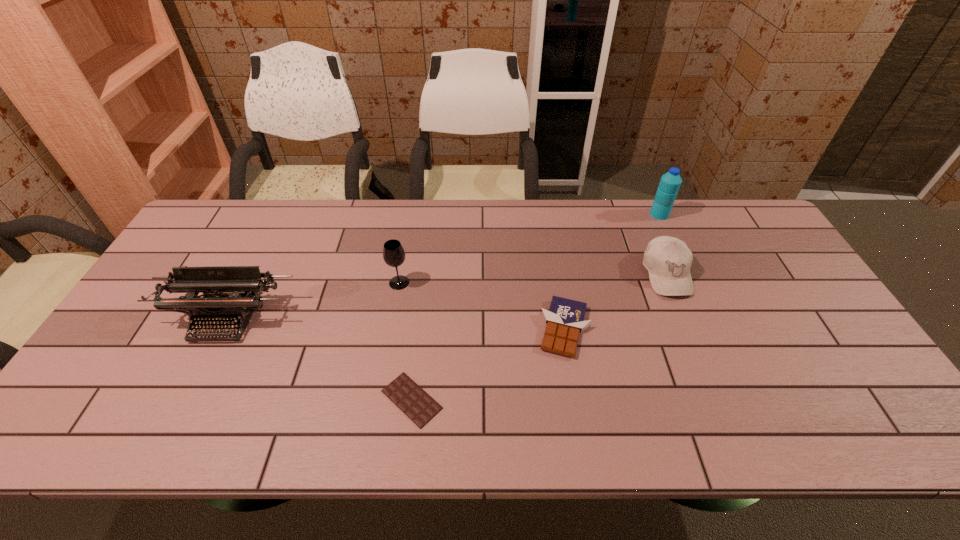
This screenshot has height=540, width=960. In order to click on unoccupied area between the nearest object and the fourth tallest object in this screenshot , I will do `click(540, 337)`.

Locate an element on the screen. This screenshot has height=540, width=960. vacant space that's between the baseball cap and the leftmost object is located at coordinates (446, 296).

Find the location of a particular element. free spot between the right chocolate bar and the wineglass is located at coordinates (x=482, y=306).

The height and width of the screenshot is (540, 960). Find the location of `the closest object to the left chocolate bar`. the closest object to the left chocolate bar is located at coordinates 565,320.

Identify which object is located as the third nearest to the nearer chocolate bar. Please provide its 2D coordinates. Your answer should be formatted as a tuple, i.e. [(x, y)], where the tuple contains the x and y coordinates of a point satisfying the conditions above.

[(243, 283)]

Where is `vacant point that satisfies the following two spatial constraints: 1. on the typing side of the leftmost object; 2. on the right side of the right chocolate bar`? Image resolution: width=960 pixels, height=540 pixels. vacant point that satisfies the following two spatial constraints: 1. on the typing side of the leftmost object; 2. on the right side of the right chocolate bar is located at coordinates (221, 328).

You are a GUI agent. You are given a task and a screenshot of the screen. Output one action in this format:
    pyautogui.click(x=<x>, y=<y>)
    Task: Click on the vacant region that satisfies the following two spatial constraints: 1. on the typing side of the typewriter; 2. on the right side of the shortest object
    This screenshot has height=540, width=960.
    Given the screenshot: What is the action you would take?
    pyautogui.click(x=185, y=400)

The height and width of the screenshot is (540, 960). Find the location of `vacant area in the image that satisfies the following two spatial constraints: 1. on the typing side of the typewriter; 2. on the right side of the taller chocolate bar`. vacant area in the image that satisfies the following two spatial constraints: 1. on the typing side of the typewriter; 2. on the right side of the taller chocolate bar is located at coordinates click(x=221, y=328).

Locate an element on the screen. vacant area that satisfies the following two spatial constraints: 1. on the typing side of the typewriter; 2. on the left side of the shorter chocolate bar is located at coordinates (185, 400).

Locate an element on the screen. vacant space that satisfies the following two spatial constraints: 1. on the back side of the shorter chocolate bar; 2. on the right side of the tallest object is located at coordinates (x=434, y=214).